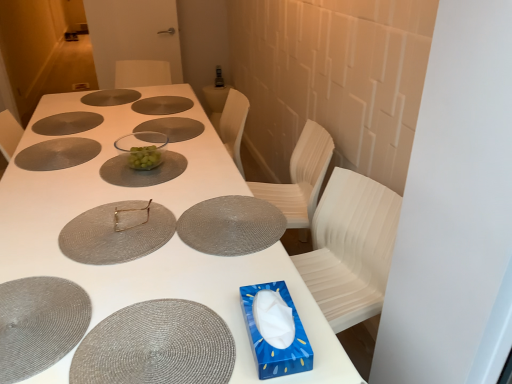
This screenshot has width=512, height=384. I want to click on vacant area that lies between transparent glass bowl at center and matte silver fork at center, so click(134, 182).